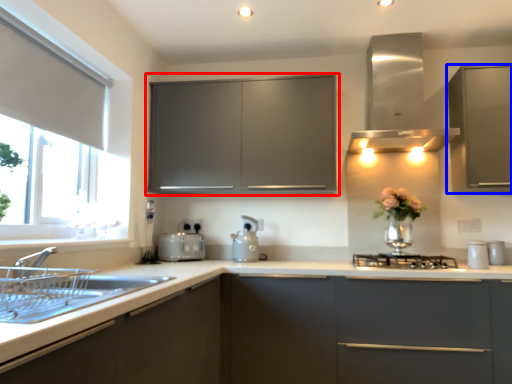
Question: Which object appears farthest to the camera in this image, cabinetry (highlighted by a red box) or cabinetry (highlighted by a blue box)?

Choices:
 (A) cabinetry
 (B) cabinetry

Answer: (A)